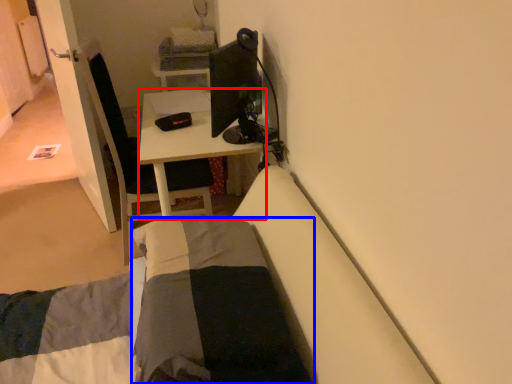
Question: Among these objects, which one is farthest to the camera, desk (highlighted by a red box) or blanket (highlighted by a blue box)?

Choices:
 (A) desk
 (B) blanket

Answer: (A)